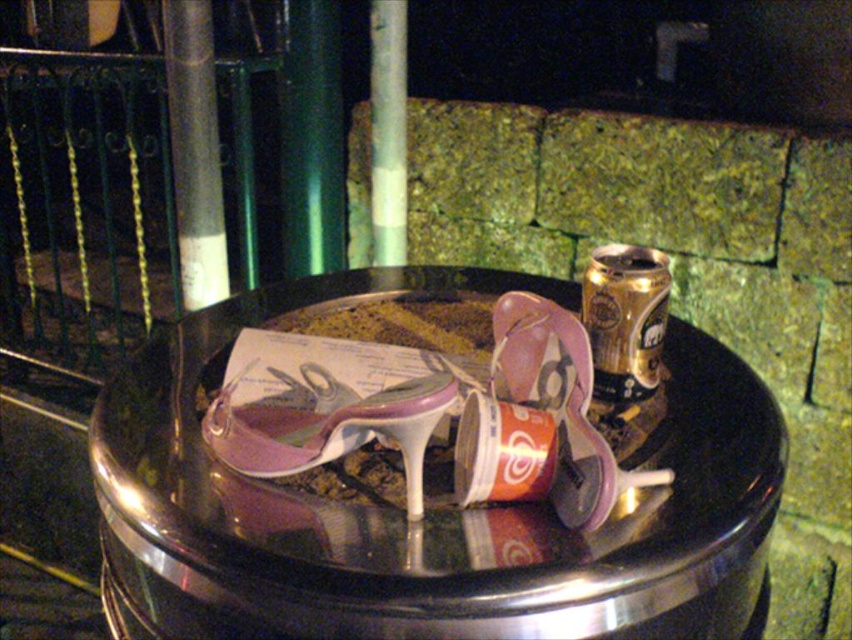
Based on the photo, which of these two, matte pink high-heeled sandal at center or gold metallic can at upper right, stands shorter?

gold metallic can at upper right is shorter.

Is matte pink high-heeled sandal at center smaller than gold metallic can at upper right?

Incorrect, matte pink high-heeled sandal at center is not smaller in size than gold metallic can at upper right.

Which is behind, point (499, 385) or point (616, 269)?

The point (499, 385) is more distant.

This screenshot has height=640, width=852. I want to click on matte pink high-heeled sandal at center, so click(561, 404).

Is purple glossy high-heeled sandal at center smaller than gold metallic can at upper right?

Incorrect, purple glossy high-heeled sandal at center is not smaller in size than gold metallic can at upper right.

From the picture: Can you confirm if purple glossy high-heeled sandal at center is thinner than gold metallic can at upper right?

No.

Find the location of a particular element. This screenshot has width=852, height=640. purple glossy high-heeled sandal at center is located at coordinates (329, 412).

Is point (396, 401) positioned behind point (597, 460)?

No, it is in front of (597, 460).

Between purple glossy high-heeled sandal at center and matte pink high-heeled sandal at center, which one appears on the left side from the viewer's perspective?

purple glossy high-heeled sandal at center

At what (x,y) coordinates should I click in order to perform the action: click on purple glossy high-heeled sandal at center. Please return your answer as a coordinate pair (x, y). This screenshot has width=852, height=640. Looking at the image, I should click on (329, 412).

Where is `purple glossy high-heeled sandal at center`? Image resolution: width=852 pixels, height=640 pixels. purple glossy high-heeled sandal at center is located at coordinates (329, 412).